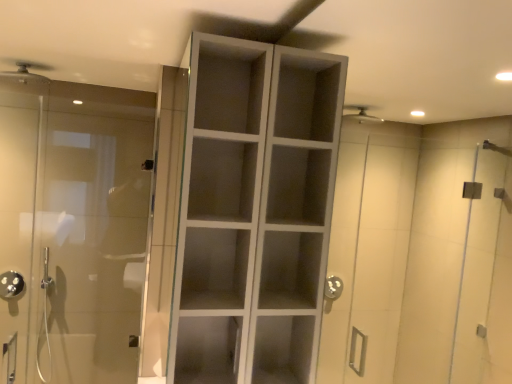
Question: Relative to white matte cabinet at center, is polished chrome showerhead at left, which appears as the first shower when viewed from the back, in front or behind?

Choices:
 (A) behind
 (B) front

Answer: (A)

Question: From a real-world perspective, is polished chrome showerhead at left, which is the first shower from left to right, physically located above or below white matte cabinet at center?

Choices:
 (A) above
 (B) below

Answer: (B)

Question: Considering the real-world distances, which object is closest to the transparent glass door at left?

Choices:
 (A) matte silver shower head at upper left, which is counted as the first shower, starting from the front
 (B) polished chrome showerhead at left, the second shower viewed from the top
 (C) white matte cabinet at center

Answer: (B)

Question: Estimate the real-world distances between objects in this image. Which object is closer to the white matte cabinet at center?

Choices:
 (A) matte silver shower head at upper left, placed as the 1th shower when sorted from top to bottom
 (B) polished chrome showerhead at left, which is the first shower from left to right
 (C) transparent glass door at left

Answer: (C)